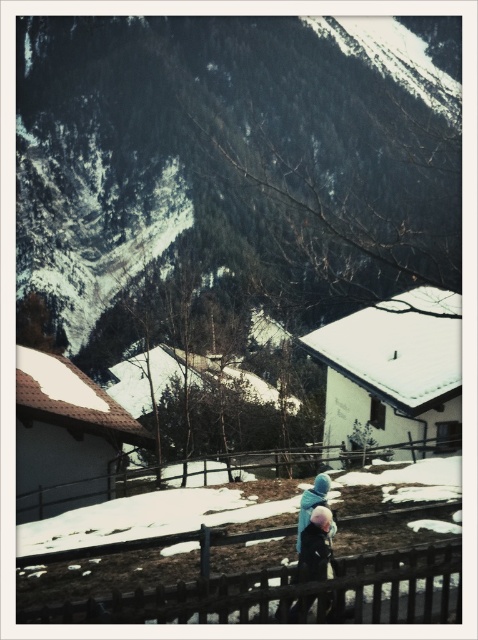
What are the coordinates of the snowy forested mountain at upper center in the image?

The snowy forested mountain at upper center is located at coordinates point (238,154).

You are a photographer trying to capture a photo of the dark blue fabric coat at center without the brown wooden fence at lower center appearing in the frame. Given that your camera has a fixed focal length, can you estimate whether adjusting your position forward or backward would help achieve this?

The brown wooden fence at lower center and dark blue fabric coat at center are 32.10 inches apart. To exclude the brown wooden fence at lower center from the frame while focusing on the dark blue fabric coat at center, you should move forward. Moving closer reduces the angle of view, potentially cropping out the fence.

You are standing in the winter scene and want to take a photo of the snowy forested mountain at upper center and the brown wooden fence at lower center. Which object will appear larger in your photo?

The snowy forested mountain at upper center will appear larger in the photo because it is taller than the brown wooden fence at lower center.